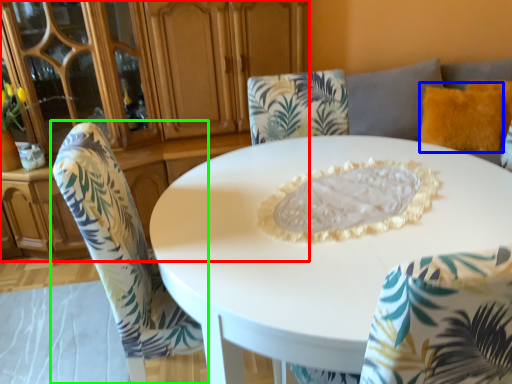
Question: Based on their relative distances, which object is nearer to dresser (highlighted by a red box)? Choose from pillow (highlighted by a blue box) and chair (highlighted by a green box).

Choices:
 (A) pillow
 (B) chair

Answer: (B)